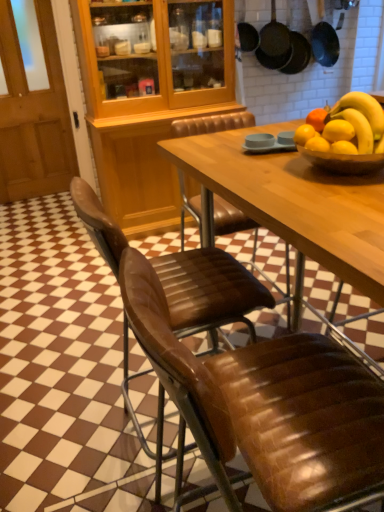
Question: From a real-world perspective, is brown leather chair at center, the second chair viewed from the back, above or below wooden door at left?

Choices:
 (A) above
 (B) below

Answer: (B)

Question: Considering their positions, is brown leather chair at center, the second chair viewed from the back, located in front of or behind wooden door at left?

Choices:
 (A) front
 (B) behind

Answer: (A)

Question: Which is farther from the black matte frying pan at upper right, arranged as the first frying pan when viewed from the left?

Choices:
 (A) wooden door at left
 (B) black matte frying pan at upper right, which is counted as the third frying pan, starting from the left
 (C) brown leather chair at center, which appears as the first chair when viewed from the back
 (D) black matte frying pan at upper center, acting as the 2th frying pan starting from the left
 (E) brown leather chair at center, positioned as the 1th chair in front-to-back order

Answer: (E)

Question: Considering the real-world distances, which object is closest to the brown leather chair at center, which appears as the first chair when viewed from the back?

Choices:
 (A) brown leather chair at center, positioned as the 1th chair in front-to-back order
 (B) black matte frying pan at upper right, the third frying pan when ordered from right to left
 (C) wooden door at left
 (D) black matte frying pan at upper center, the second frying pan positioned from the right
 (E) black matte frying pan at upper right, which is counted as the third frying pan, starting from the left

Answer: (A)